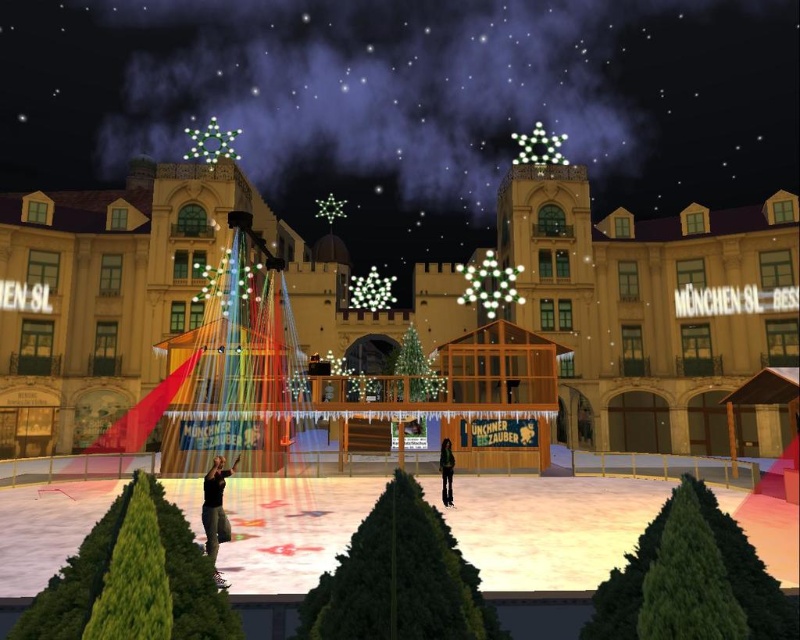
Question: Can you confirm if black leather jacket at lower center is smaller than green fabric pants at center?

Choices:
 (A) yes
 (B) no

Answer: (B)

Question: Which point is farther to the camera?

Choices:
 (A) (444, 477)
 (B) (208, 529)

Answer: (A)

Question: Can you confirm if black leather jacket at lower center is positioned to the left of green fabric pants at center?

Choices:
 (A) yes
 (B) no

Answer: (A)

Question: Is black leather jacket at lower center further to the viewer compared to green fabric pants at center?

Choices:
 (A) no
 (B) yes

Answer: (A)